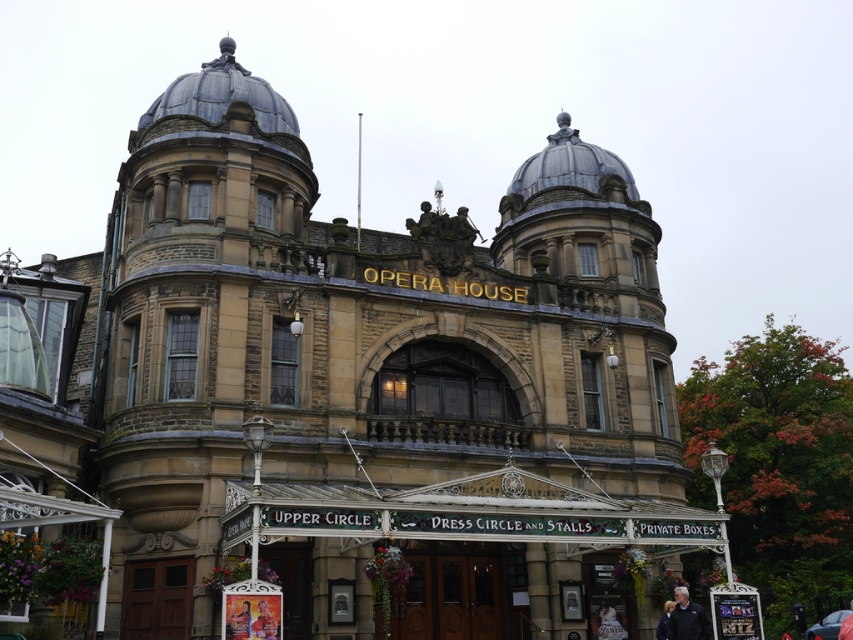
Question: Among these points, which one is farthest from the camera?

Choices:
 (A) (701, 630)
 (B) (610, 632)
 (C) (280, 624)
 (D) (654, 630)

Answer: (D)

Question: Which of these objects is positioned closest to the matte red dress at center?

Choices:
 (A) white cotton shirt at lower right
 (B) black fabric at lower right
 (C) dark blue jacket at lower right

Answer: (B)

Question: Does black fabric at lower right have a lesser width compared to dark blue jacket at lower right?

Choices:
 (A) no
 (B) yes

Answer: (A)

Question: Among these objects, which one is farthest from the camera?

Choices:
 (A) white cotton shirt at lower right
 (B) matte red dress at center

Answer: (A)

Question: Is black fabric at lower right above white cotton shirt at lower right?

Choices:
 (A) yes
 (B) no

Answer: (A)

Question: Can you confirm if matte yellow dress at center is thinner than white cotton shirt at lower right?

Choices:
 (A) yes
 (B) no

Answer: (A)